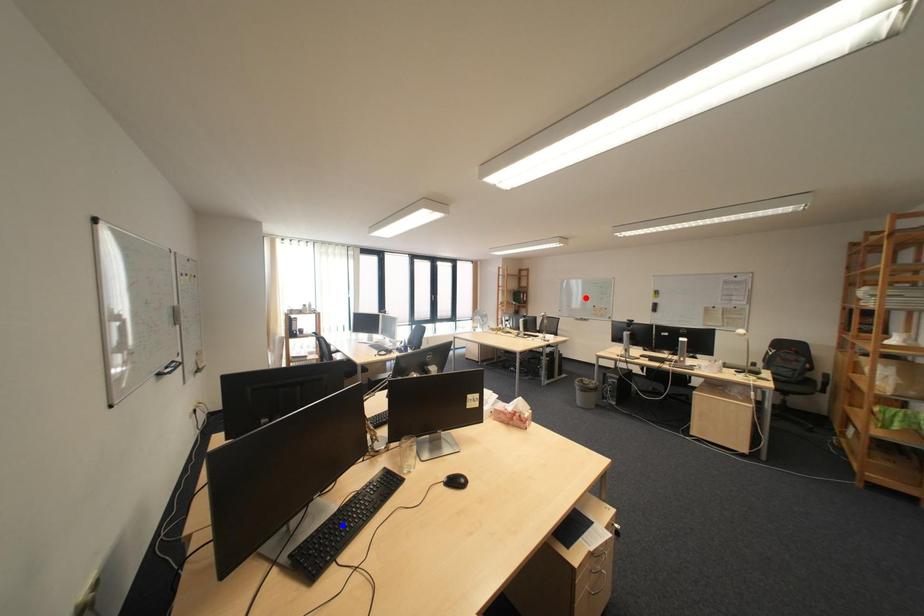
Question: Two points are marked on the image. Which point is closer to the camera?

Choices:
 (A) Blue point is closer.
 (B) Red point is closer.

Answer: (A)